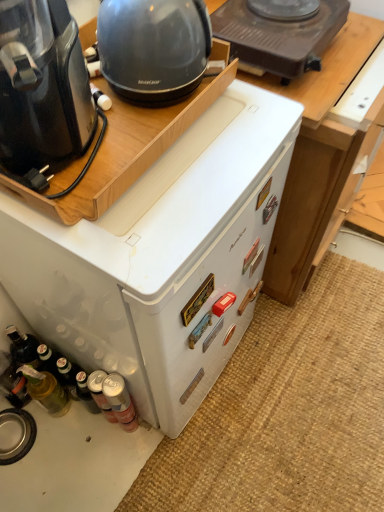
Question: Based on their sizes in the image, would you say brown plastic stove at upper center is bigger or smaller than metallic silver can at lower left, arranged as the 2th bottle when viewed from the left?

Choices:
 (A) big
 (B) small

Answer: (A)

Question: Relative to metallic silver can at lower left, which is the second bottle from right to left, is brown plastic stove at upper center in front or behind?

Choices:
 (A) behind
 (B) front

Answer: (B)

Question: Which object is positioned closest to the metallic silver can at lower left, the 3th bottle viewed from the left?

Choices:
 (A) translucent glass bottle at lower left, acting as the first bottle starting from the left
 (B) white wood table at center
 (C) matte black kettle at upper left
 (D) brown plastic stove at upper center
 (E) black plastic coffee maker at left, marked as the second home appliance in a back-to-front arrangement

Answer: (A)

Question: Which is nearer to the translucent glass bottle at lower left, acting as the first bottle starting from the left?

Choices:
 (A) metallic silver can at lower left, which is the second bottle from right to left
 (B) brown plastic stove at upper center
 (C) black plastic coffee maker at left, arranged as the 1th home appliance when viewed from the front
 (D) white matte refrigerator at center, positioned as the second home appliance in front-to-back order
 (E) matte black kettle at upper left

Answer: (A)